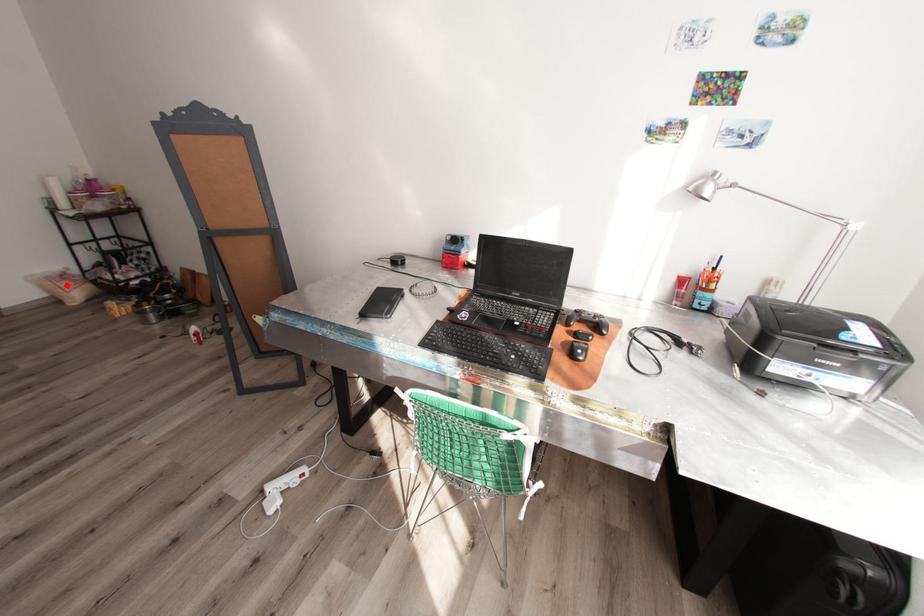
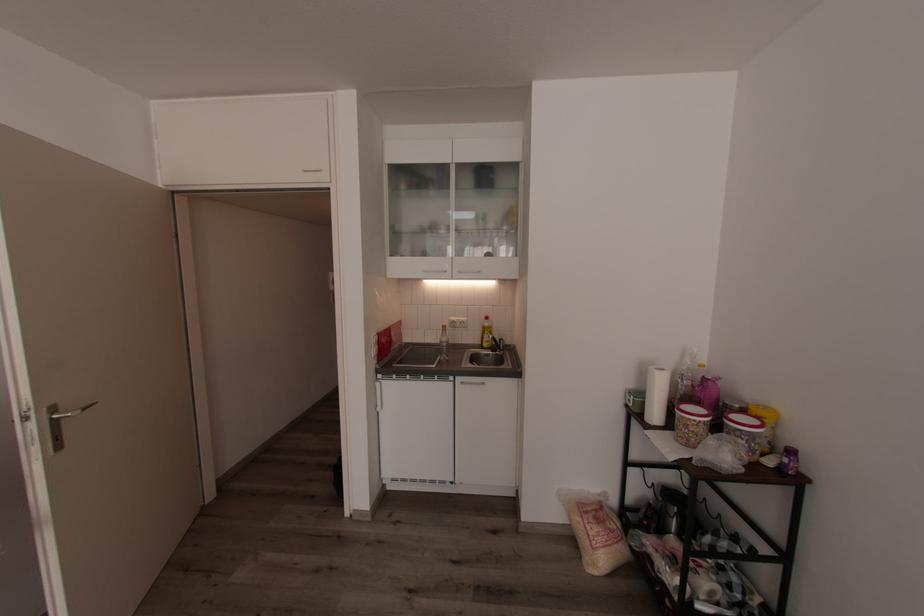
Question: I am providing you with two images of the same scene from different viewpoints. Image1 has a red point marked. In image2, the corresponding 3D location appears at what relative position? Reply with the corresponding letter.

Choices:
 (A) Closer
 (B) Farther

Answer: (B)